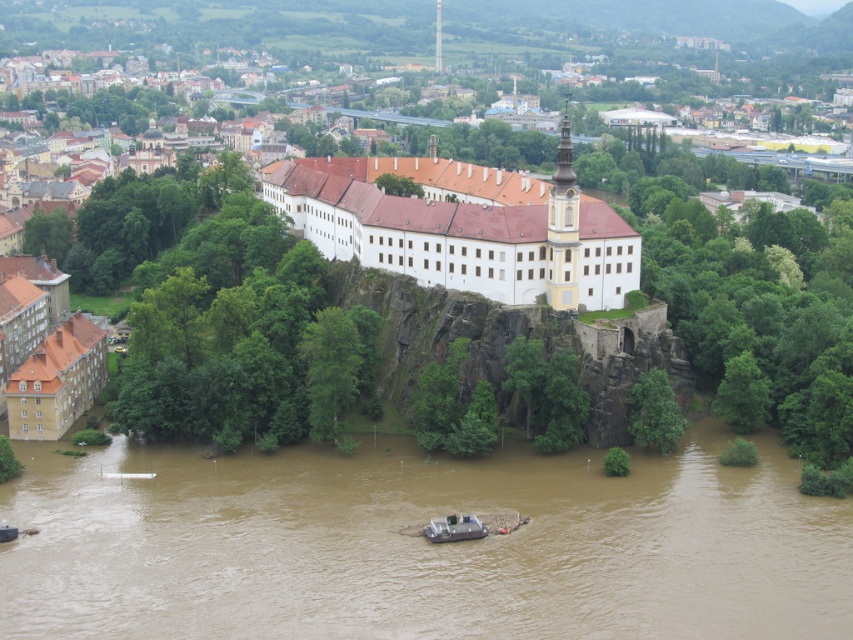
You are standing at the point closer to the camera in the image. Which point are you at, point (x=407, y=220) or point (x=459, y=538)?

You are at point (x=407, y=220) because it is closer to the camera than point (x=459, y=538).

You are a tourist standing on the flooded path near the brown muddy water at lower center and want to reach the entrance of the white smooth building at center. Based on the scene description, which direction should you head to avoid the flooded area?

You should head upwards towards the white smooth building at center since the brown muddy water at lower center is located below it, indicating the building is on higher ground.

You are a photographer planning to capture the historic building on the rocky outcrop. You want to ensure the brown muddy water at lower center and the metallic gray boat at center are both visible in the frame. Which object should you focus on to include both in your composition?

The brown muddy water at lower center is larger in size than the metallic gray boat at center. To include both in the frame, focus on the brown muddy water at lower center as it occupies more space, allowing the smaller metallic gray boat at center to fit within the composition.